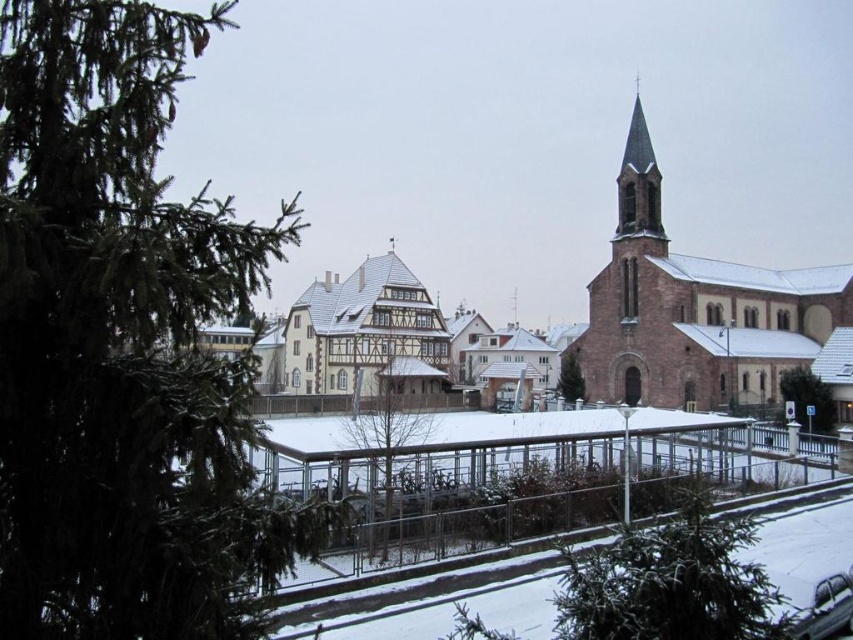
From the picture: Can you confirm if green needle-like tree at left is positioned above clear glass fence at center?

Yes, green needle-like tree at left is above clear glass fence at center.

Can you confirm if green needle-like tree at left is positioned below clear glass fence at center?

Actually, green needle-like tree at left is above clear glass fence at center.

Describe the element at coordinates (123, 346) in the screenshot. The width and height of the screenshot is (853, 640). I see `green needle-like tree at left` at that location.

Locate an element on the screen. The height and width of the screenshot is (640, 853). green needle-like tree at left is located at coordinates [123, 346].

Does red brick church at upper right appear under green textured pine tree at center?

Incorrect, red brick church at upper right is not positioned below green textured pine tree at center.

Is point (770, 385) positioned in front of point (560, 394)?

Yes, it is.

Which is behind, point (712, 273) or point (569, 394)?

Point (712, 273)

Where is `red brick church at upper right`? red brick church at upper right is located at coordinates (695, 310).

This screenshot has width=853, height=640. Describe the element at coordinates (364, 333) in the screenshot. I see `wooden timber frame house at center` at that location.

Does wooden timber frame house at center have a smaller size compared to green matte tree at lower right?

No, wooden timber frame house at center is not smaller than green matte tree at lower right.

Between point (344, 314) and point (813, 420), which one is positioned in front?

Point (813, 420) is in front.

Find the location of a particular element. wooden timber frame house at center is located at coordinates (364, 333).